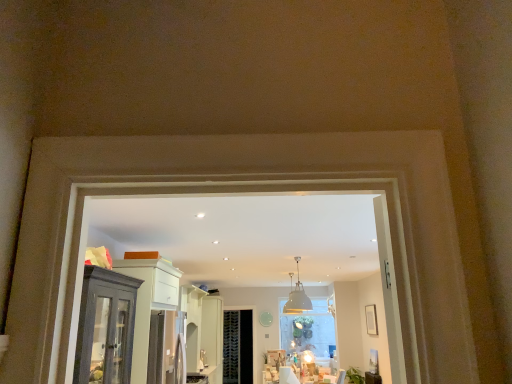
What do you see at coordinates (149, 303) in the screenshot? This screenshot has width=512, height=384. I see `matte dark wood cabinet at left` at bounding box center [149, 303].

I want to click on white matte light fixture at upper center, so (x=297, y=297).

I want to click on matte white picture frame at right, so click(x=371, y=319).

Image resolution: width=512 pixels, height=384 pixels. I want to click on black mesh screen door at center, so click(x=238, y=347).

Is black mesh screen door at center facing towards white matte light fixture at upper center?

Yes, black mesh screen door at center faces towards white matte light fixture at upper center.

In the scene shown: Are black mesh screen door at center and white matte light fixture at upper center beside each other?

No.

Does black mesh screen door at center contain white matte light fixture at upper center?

Actually, white matte light fixture at upper center is outside black mesh screen door at center.

Is black mesh screen door at center closer to camera compared to white matte light fixture at upper center?

No, it is not.

Which object is further away from the camera, satin silver fridge at center or black mesh screen door at center?

black mesh screen door at center is further away from the camera.

What's the angular difference between satin silver fridge at center and black mesh screen door at center's facing directions?

The angular difference between satin silver fridge at center and black mesh screen door at center is 90.5 degrees.

Between point (191, 383) and point (231, 341), which one is positioned behind?

The point (231, 341) is more distant.

Could you tell me if satin silver fridge at center is turned towards black mesh screen door at center?

No, satin silver fridge at center is not turned towards black mesh screen door at center.

Would you say white glossy door at center is outside white matte light fixture at upper center?

Yes.

Which is behind, white glossy door at center or white matte light fixture at upper center?

white glossy door at center.

Considering the positions of points (209, 337) and (298, 284), is point (209, 337) closer to camera compared to point (298, 284)?

That is True.

Where is `door below the white matte light fixture at upper center (from the image's perspective)`? The height and width of the screenshot is (384, 512). door below the white matte light fixture at upper center (from the image's perspective) is located at coordinates (212, 338).

In terms of height, does matte white picture frame at right look taller or shorter compared to satin silver fridge at center?

Considering their sizes, matte white picture frame at right has more height than satin silver fridge at center.

Is matte white picture frame at right further to the viewer compared to satin silver fridge at center?

Yes, the depth of matte white picture frame at right is greater than that of satin silver fridge at center.

Is point (369, 334) closer to camera compared to point (189, 374)?

That is False.

From the image's perspective, is matte white picture frame at right positioned above or below satin silver fridge at center?

matte white picture frame at right is above satin silver fridge at center.

Considering the relative positions of white glossy door at center and matte dark wood cabinet at left in the image provided, is white glossy door at center to the left or to the right of matte dark wood cabinet at left?

white glossy door at center is positioned on matte dark wood cabinet at left's right side.

Between white glossy door at center and matte dark wood cabinet at left, which one has more height?

Standing taller between the two is white glossy door at center.

Does point (204, 298) appear closer or farther from the camera than point (160, 288)?

Clearly, point (204, 298) is more distant from the camera than point (160, 288).

Considering the relative sizes of matte white picture frame at right and white glossy door at center in the image provided, is matte white picture frame at right thinner than white glossy door at center?

Yes.

At what (x,y) coordinates should I click in order to perform the action: click on picture frame that appears on the right of white glossy door at center. Please return your answer as a coordinate pair (x, y). Looking at the image, I should click on (371, 319).

Does matte white picture frame at right have a smaller size compared to white glossy door at center?

Correct, matte white picture frame at right occupies less space than white glossy door at center.

From the image's perspective, does matte white picture frame at right appear lower than white glossy door at center?

No, from the image's perspective, matte white picture frame at right is not below white glossy door at center.

Between black mesh screen door at center and white glossy door at center, which one has larger width?

Wider between the two is white glossy door at center.

From the image's perspective, is black mesh screen door at center located beneath white glossy door at center?

Indeed, from the image's perspective, black mesh screen door at center is shown beneath white glossy door at center.

How many degrees apart are the facing directions of black mesh screen door at center and white glossy door at center?

90.8 degrees separate the facing orientations of black mesh screen door at center and white glossy door at center.

The height and width of the screenshot is (384, 512). I want to click on door above the black mesh screen door at center (from a real-world perspective), so [212, 338].

Identify the location of light fixture that is above the black mesh screen door at center (from a real-world perspective). The height and width of the screenshot is (384, 512). click(x=297, y=297).

In order to click on appliance lying above the black mesh screen door at center (from the image's perspective) in this screenshot , I will do `click(197, 378)`.

From the image, which object appears to be nearer to matte dark wood cabinet at left, white glossy door at center or white matte light fixture at upper center?

Among the two, white glossy door at center is located nearer to matte dark wood cabinet at left.

From the image, which object appears to be nearer to black mesh screen door at center, white matte light fixture at upper center or matte white picture frame at right?

white matte light fixture at upper center lies closer to black mesh screen door at center than the other object.

From the image, which object appears to be farther from matte white picture frame at right, matte dark wood cabinet at left or black mesh screen door at center?

matte dark wood cabinet at left is positioned further to the anchor matte white picture frame at right.

Looking at the image, which one is located closer to white matte light fixture at upper center, black mesh screen door at center or white glossy door at center?

black mesh screen door at center is positioned closer to the anchor white matte light fixture at upper center.

From the image, which object appears to be farther from matte dark wood cabinet at left, black mesh screen door at center or white matte light fixture at upper center?

Based on the image, black mesh screen door at center appears to be further to matte dark wood cabinet at left.

From the image, which object appears to be farther from white glossy door at center, matte dark wood cabinet at left or satin silver fridge at center?

matte dark wood cabinet at left.

From the image, which object appears to be nearer to white glossy door at center, matte dark wood cabinet at left or matte white picture frame at right?

Based on the image, matte white picture frame at right appears to be nearer to white glossy door at center.

Based on their spatial positions, is black mesh screen door at center or satin silver fridge at center further from white glossy door at center?

satin silver fridge at center is positioned further to the anchor white glossy door at center.

Find the location of a particular element. appliance between white matte light fixture at upper center and white glossy door at center in the front-back direction is located at coordinates (197, 378).

You are a GUI agent. You are given a task and a screenshot of the screen. Output one action in this format:
    pyautogui.click(x=<x>, y=<y>)
    Task: Click on the door between white matte light fixture at upper center and black mesh screen door at center from front to back
    The height and width of the screenshot is (384, 512).
    Given the screenshot: What is the action you would take?
    (212, 338)

At what (x,y) coordinates should I click in order to perform the action: click on light fixture between white glossy door at center and matte white picture frame at right. Please return your answer as a coordinate pair (x, y). The height and width of the screenshot is (384, 512). Looking at the image, I should click on (297, 297).

Find the location of `light fixture between matte dark wood cabinet at left and white glossy door at center from front to back`. light fixture between matte dark wood cabinet at left and white glossy door at center from front to back is located at coordinates (297, 297).